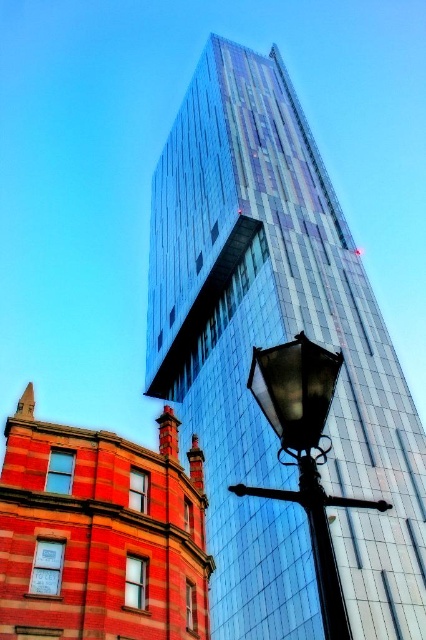
Between shiny glass skyscraper at center and black glass street light at lower right, which one is positioned lower?

shiny glass skyscraper at center is below.

What do you see at coordinates (275, 342) in the screenshot? I see `shiny glass skyscraper at center` at bounding box center [275, 342].

The width and height of the screenshot is (426, 640). Identify the location of shiny glass skyscraper at center. (275, 342).